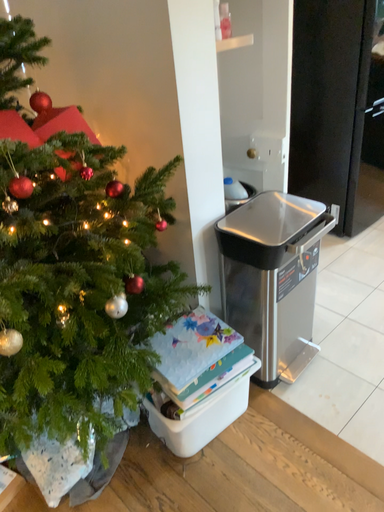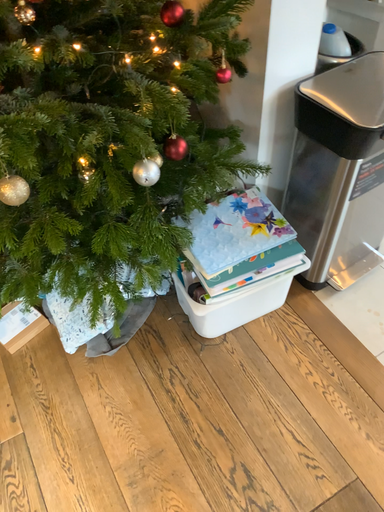
Question: Which way did the camera rotate in the video?

Choices:
 (A) rotated upward
 (B) rotated downward

Answer: (B)